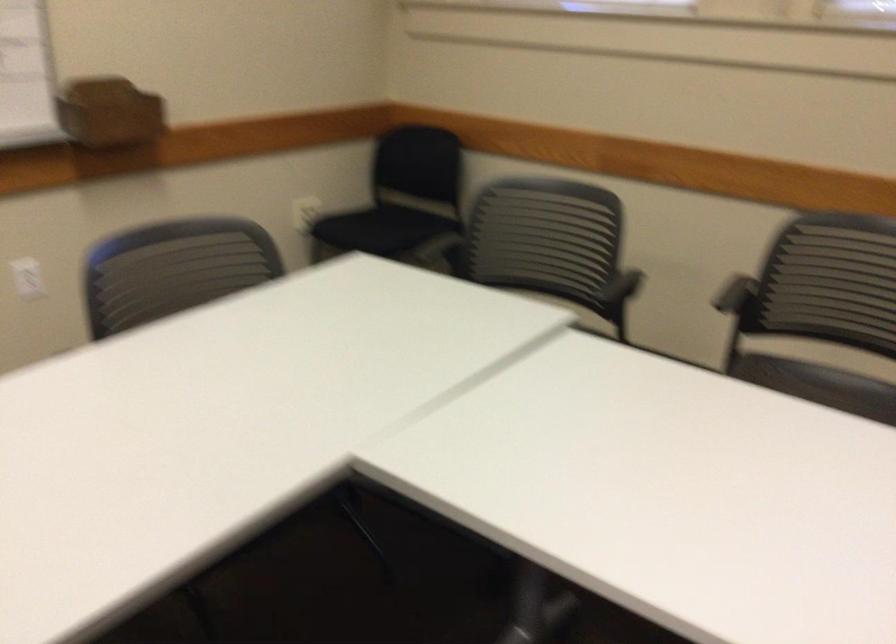
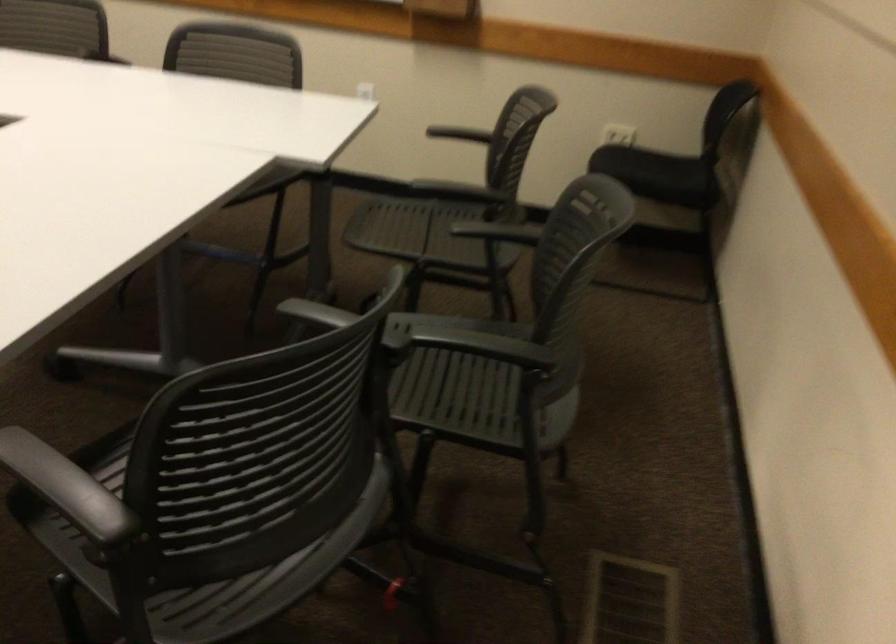
Locate, in the second image, the point that corresponds to (384,230) in the first image.

(634, 166)